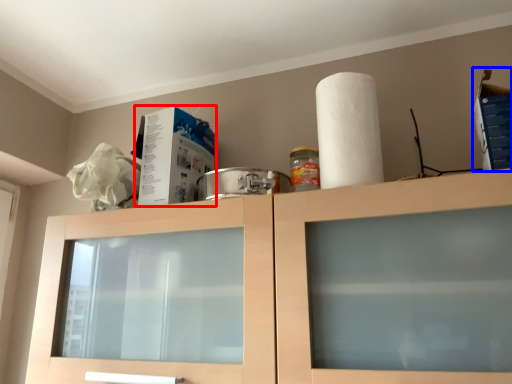
Question: Among these objects, which one is nearest to the camera, box (highlighted by a red box) or box (highlighted by a blue box)?

Choices:
 (A) box
 (B) box

Answer: (B)